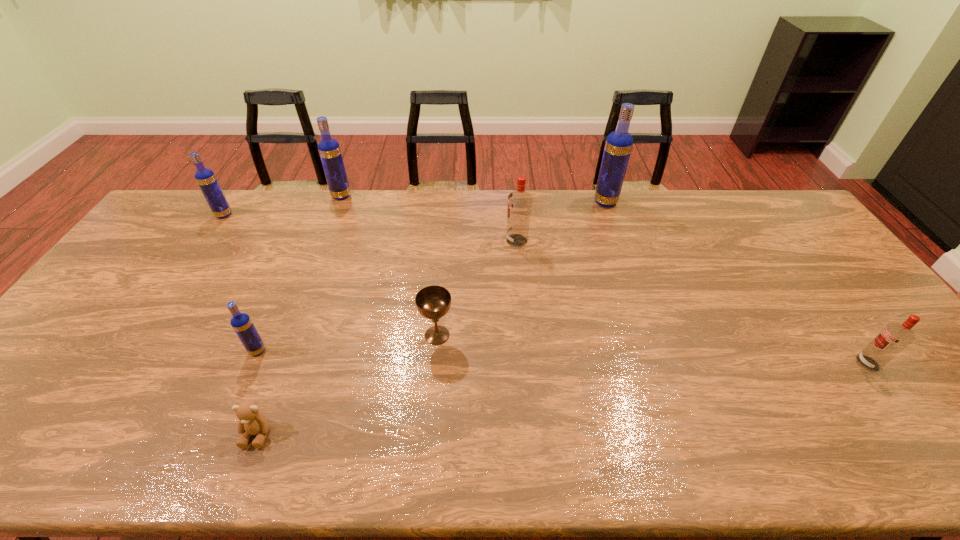
Where is `free spot at the near edge of the desktop`? Image resolution: width=960 pixels, height=540 pixels. free spot at the near edge of the desktop is located at coordinates click(x=844, y=465).

Where is `vacant space at the left edge`? Image resolution: width=960 pixels, height=540 pixels. vacant space at the left edge is located at coordinates pos(170,251).

In the image, there is a desktop. Where is `vacant space at the far right corner`? The image size is (960, 540). vacant space at the far right corner is located at coordinates (780, 203).

At what (x,y) coordinates should I click in order to perform the action: click on free space between the chalice and the teddy bear. Please return your answer as a coordinate pair (x, y). This screenshot has width=960, height=540. Looking at the image, I should click on (348, 384).

This screenshot has width=960, height=540. I want to click on free space that is in between the fifth vodka from right to left and the brown teddy bear, so click(x=257, y=392).

Where is `blank region between the third nearest vodka and the seventh tallest object`? The height and width of the screenshot is (540, 960). blank region between the third nearest vodka and the seventh tallest object is located at coordinates (477, 288).

I want to click on vacant area between the right red vodka and the third blue vodka from left to right, so [x=605, y=280].

Where is `vacant point located between the teddy bear and the farther red vodka`? This screenshot has width=960, height=540. vacant point located between the teddy bear and the farther red vodka is located at coordinates (387, 337).

Locate an element on the screen. free spot between the bigger red vodka and the nearer red vodka is located at coordinates (692, 302).

What are the coordinates of `unoccupied area between the nearest object and the second blue vodka from right to left` in the screenshot? It's located at 300,315.